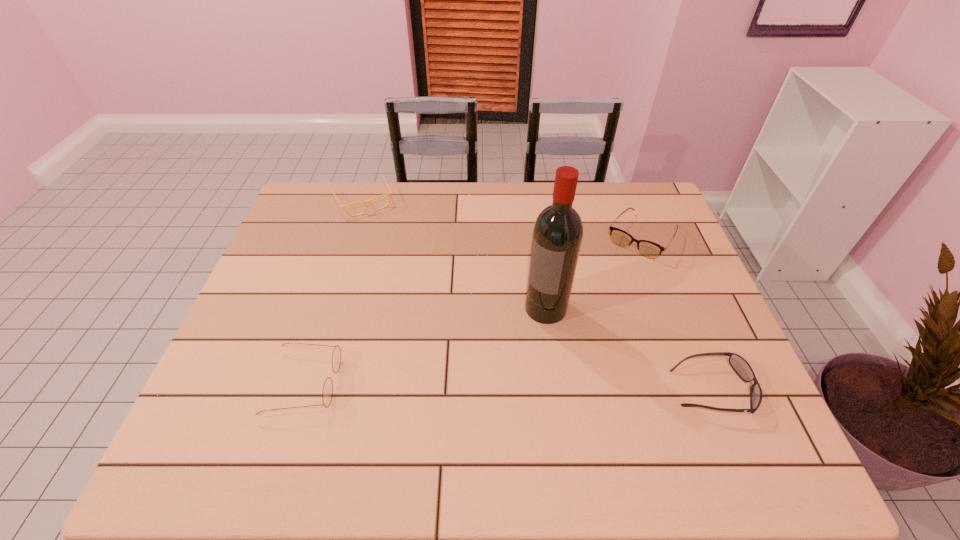
Where is `vacant space at the far edge of the desktop`? vacant space at the far edge of the desktop is located at coordinates (476, 185).

Where is `vacant area at the near edge`? The image size is (960, 540). vacant area at the near edge is located at coordinates (310, 389).

Locate an element on the screen. Image resolution: width=960 pixels, height=540 pixels. vacant space at the left edge is located at coordinates (x=264, y=273).

Where is `vacant space at the right edge`? vacant space at the right edge is located at coordinates (685, 293).

The height and width of the screenshot is (540, 960). In the image, there is a desktop. In order to click on free region at the far right corner in this screenshot , I will do `click(626, 210)`.

The height and width of the screenshot is (540, 960). I want to click on unoccupied area between the sunglasses and the nearest spectacles, so point(509,386).

The image size is (960, 540). Identify the location of vacant point located between the tallest object and the nearest spectacles. (425, 345).

This screenshot has height=540, width=960. I want to click on free space between the sunglasses and the rightmost spectacles, so click(677, 313).

Identify the location of empty location between the third object from left to right and the rightmost spectacles. (593, 272).

Find the location of `free spot between the sunglasses and the third nearest object`. free spot between the sunglasses and the third nearest object is located at coordinates (629, 349).